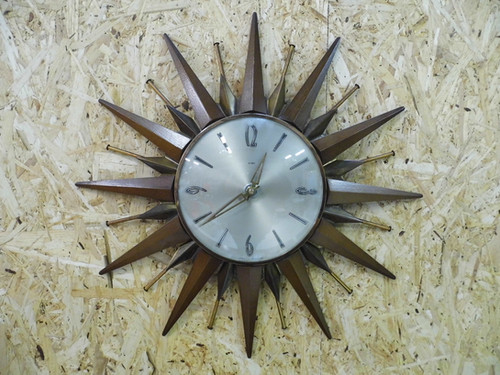
Image resolution: width=500 pixels, height=375 pixels. What are the coordinates of `light brown wall` in the screenshot? It's located at (58, 30).